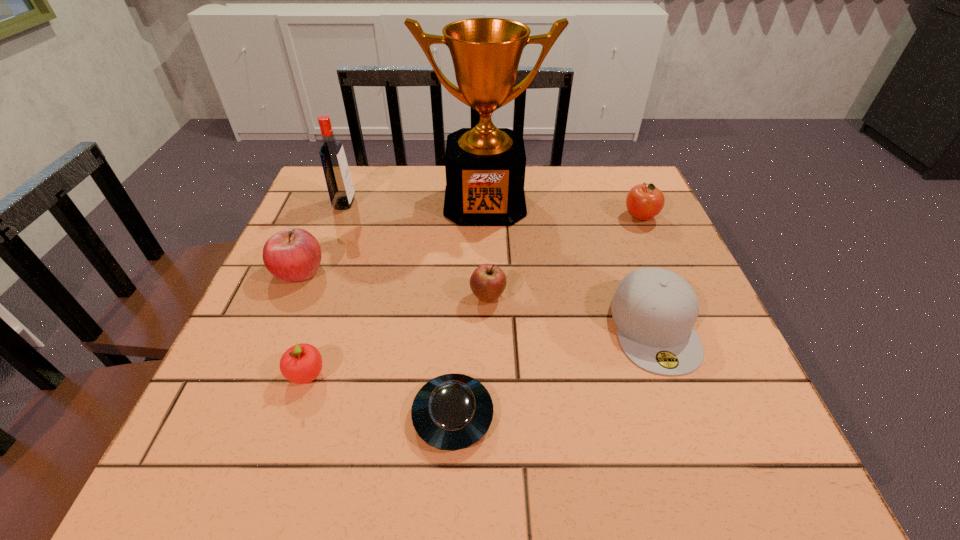
You are a GUI agent. You are given a task and a screenshot of the screen. Output one action in this format:
    pyautogui.click(x=<x>, y=<y>)
    Task: Click on the trophy cup
    The width and height of the screenshot is (960, 540).
    Given the screenshot: What is the action you would take?
    pyautogui.click(x=485, y=166)

Where is `vodka`? vodka is located at coordinates (336, 171).

Locate an element on the screen. The height and width of the screenshot is (540, 960). the farthest apple is located at coordinates (644, 201).

Image resolution: width=960 pixels, height=540 pixels. Identify the location of the leftmost apple. (293, 255).

Where is `cap`? The height and width of the screenshot is (540, 960). cap is located at coordinates (655, 309).

Locate an element on the screen. The image size is (960, 540). the second apple from right to left is located at coordinates (488, 281).

What are the coordinates of `the nearest apple` in the screenshot? It's located at (302, 363).

You are a GUI agent. You are given a task and a screenshot of the screen. Output one action in this format:
    pyautogui.click(x=<x>, y=<y>)
    Task: Click on the shortest object
    
    Given the screenshot: What is the action you would take?
    pyautogui.click(x=450, y=412)

You are a GUI agent. You are given a task and a screenshot of the screen. Output one action in this format:
    pyautogui.click(x=<x>, y=<y>)
    Task: Click on the free location located on the front of the trophy cup with the label
    This screenshot has height=540, width=960.
    Given the screenshot: What is the action you would take?
    pyautogui.click(x=486, y=261)

Where is `vacant position located on the front and back of the vodka`? This screenshot has height=540, width=960. vacant position located on the front and back of the vodka is located at coordinates (444, 203).